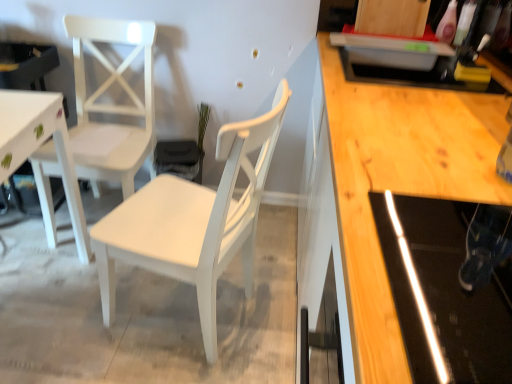
You are a GUI agent. You are given a task and a screenshot of the screen. Output one action in this format:
    pyautogui.click(x=<x>, y=<y>)
    Task: Click on the free location in front of white matte chair at left, the 1th chair in the left-to-right sequence
    This screenshot has width=512, height=384.
    Given the screenshot: What is the action you would take?
    pyautogui.click(x=54, y=281)